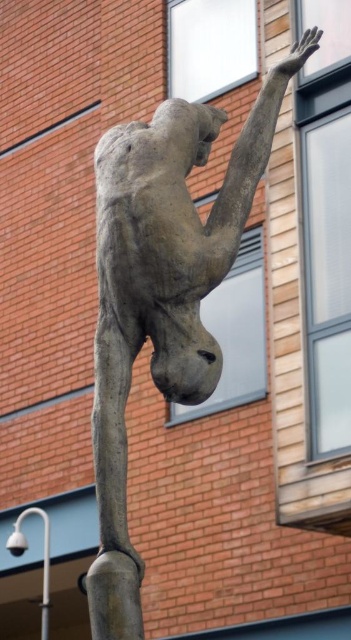
You are standing in front of a sculpture garden and see the bronze statue at center and the white metal pole at lower left. Which object is positioned more to the left side of the scene?

The white metal pole at lower left is positioned more to the left side of the scene compared to the bronze statue at center.

You are standing in front of a sculpture garden and see the bronze statue at center. If you want to take a photo of it from the exact center point, which is at coordinates 0.459, 0.462, where should you aim your camera?

The bronze statue at center is located at the 2D coordinates point (162, 292), so you should aim your camera directly at that point to capture the statue from its exact center.